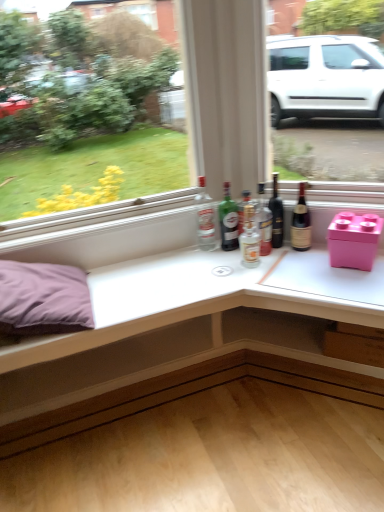
Question: Is white glossy table at upper center to the left of pink plastic storage box at right from the viewer's perspective?

Choices:
 (A) yes
 (B) no

Answer: (A)

Question: Is white glossy table at upper center closer to camera compared to pink plastic storage box at right?

Choices:
 (A) no
 (B) yes

Answer: (B)

Question: Are white glossy table at upper center and pink plastic storage box at right located far from each other?

Choices:
 (A) yes
 (B) no

Answer: (B)

Question: From a real-world perspective, is white glossy table at upper center below pink plastic storage box at right?

Choices:
 (A) yes
 (B) no

Answer: (A)

Question: Is the depth of white glossy table at upper center greater than that of pink plastic storage box at right?

Choices:
 (A) no
 (B) yes

Answer: (A)

Question: Considering the relative sizes of white glossy table at upper center and pink plastic storage box at right in the image provided, is white glossy table at upper center wider than pink plastic storage box at right?

Choices:
 (A) no
 (B) yes

Answer: (B)

Question: Is the depth of translucent glass bottle at center, placed as the third bottle when sorted from right to left, greater than that of brown glass bottle at right, arranged as the fifth bottle when viewed from the left?

Choices:
 (A) no
 (B) yes

Answer: (B)

Question: From the image's perspective, is translucent glass bottle at center, the third bottle viewed from the left, over brown glass bottle at right, arranged as the fifth bottle when viewed from the left?

Choices:
 (A) yes
 (B) no

Answer: (B)

Question: Does translucent glass bottle at center, placed as the third bottle when sorted from right to left, have a greater width compared to brown glass bottle at right, arranged as the fifth bottle when viewed from the left?

Choices:
 (A) yes
 (B) no

Answer: (B)

Question: Considering the relative positions of translucent glass bottle at center, the third bottle viewed from the left, and brown glass bottle at right, arranged as the fifth bottle when viewed from the left, in the image provided, is translucent glass bottle at center, the third bottle viewed from the left, in front of brown glass bottle at right, arranged as the fifth bottle when viewed from the left,?

Choices:
 (A) yes
 (B) no

Answer: (B)

Question: From the image's perspective, is translucent glass bottle at center, the third bottle viewed from the left, beneath brown glass bottle at right, arranged as the fifth bottle when viewed from the left?

Choices:
 (A) yes
 (B) no

Answer: (A)

Question: From a real-world perspective, is translucent glass bottle at center, placed as the third bottle when sorted from right to left, over brown glass bottle at right, arranged as the fifth bottle when viewed from the left?

Choices:
 (A) no
 (B) yes

Answer: (A)

Question: Is white glossy table at upper center outside dark glass bottle at center?

Choices:
 (A) no
 (B) yes

Answer: (B)